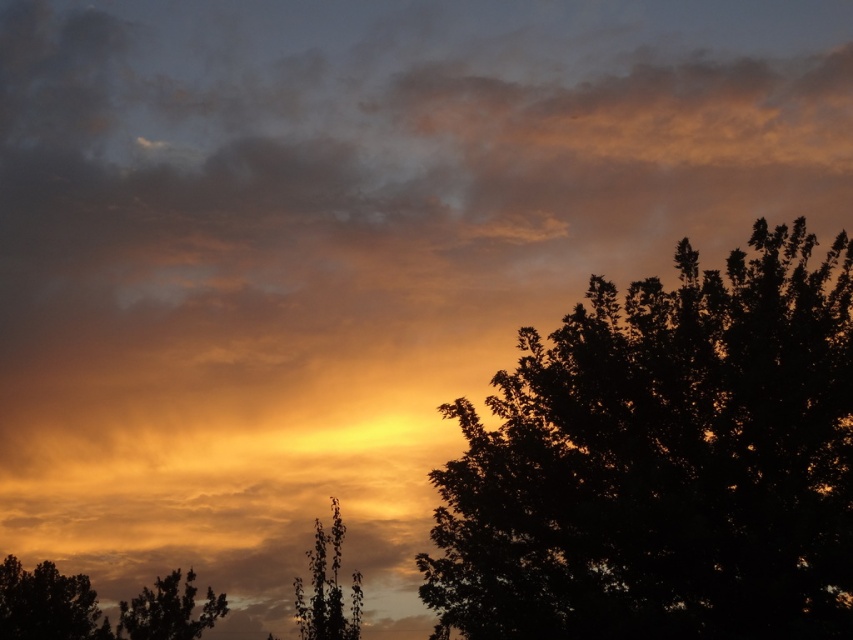
You are an astronomer trying to determine the direction of the sunset. You notice the silhouette leafy tree at right in the image. Based on its position, can you estimate the direction the sun is setting?

The silhouette leafy tree at right is positioned at point (x=663, y=464), which indicates that the sun is setting to the west, as the tree is casting its shadow towards the east side of the image.

You are an artist sketching this sunset scene. You want to draw the silhouette leafy tree at right and silhouette leafy tree at lower left. Which tree should you draw first if you want to place them in the correct left to right order?

You should draw the silhouette leafy tree at lower left first because it is positioned to the left of the silhouette leafy tree at right.